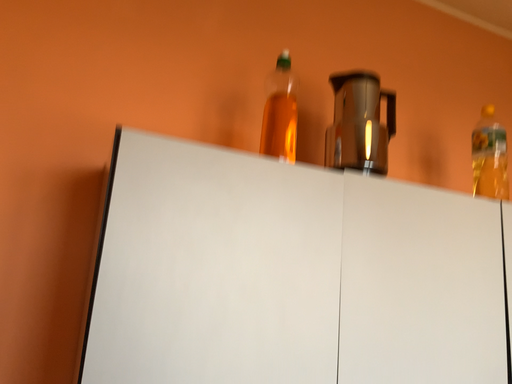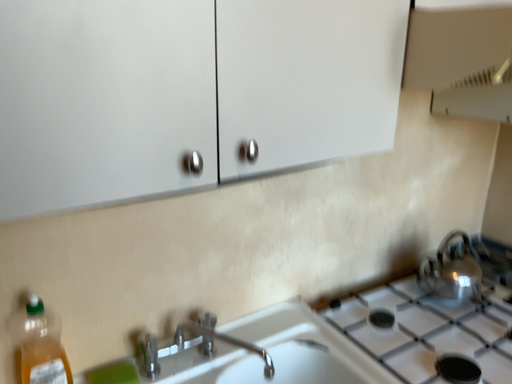
Question: Which way did the camera rotate in the video?

Choices:
 (A) rotated downward
 (B) rotated upward

Answer: (A)